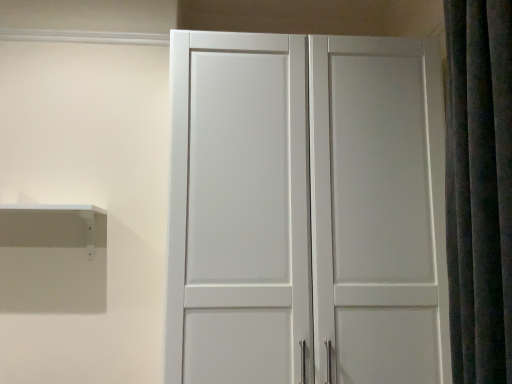
Question: Is white matte shelf at left positioned behind dark gray velvet shower curtain at right?

Choices:
 (A) yes
 (B) no

Answer: (A)

Question: Is white matte shelf at left outside dark gray velvet shower curtain at right?

Choices:
 (A) no
 (B) yes

Answer: (B)

Question: Does white matte shelf at left appear on the right side of dark gray velvet shower curtain at right?

Choices:
 (A) no
 (B) yes

Answer: (A)

Question: From a real-world perspective, is white matte shelf at left over dark gray velvet shower curtain at right?

Choices:
 (A) no
 (B) yes

Answer: (A)

Question: Can you confirm if white matte shelf at left is smaller than dark gray velvet shower curtain at right?

Choices:
 (A) no
 (B) yes

Answer: (B)

Question: Is white matte shelf at left closer to the viewer compared to dark gray velvet shower curtain at right?

Choices:
 (A) yes
 (B) no

Answer: (B)

Question: Is the position of dark gray velvet shower curtain at right less distant than that of white matte shelf at left?

Choices:
 (A) no
 (B) yes

Answer: (B)

Question: Is dark gray velvet shower curtain at right thinner than white matte shelf at left?

Choices:
 (A) yes
 (B) no

Answer: (B)

Question: Can you confirm if dark gray velvet shower curtain at right is positioned to the left of white matte shelf at left?

Choices:
 (A) yes
 (B) no

Answer: (B)

Question: From the image's perspective, does dark gray velvet shower curtain at right appear lower than white matte shelf at left?

Choices:
 (A) no
 (B) yes

Answer: (A)

Question: From a real-world perspective, is dark gray velvet shower curtain at right physically below white matte shelf at left?

Choices:
 (A) yes
 (B) no

Answer: (B)

Question: Does dark gray velvet shower curtain at right contain white matte shelf at left?

Choices:
 (A) no
 (B) yes

Answer: (A)

Question: From the image's perspective, relative to white matte shelf at left, is dark gray velvet shower curtain at right above or below?

Choices:
 (A) above
 (B) below

Answer: (A)